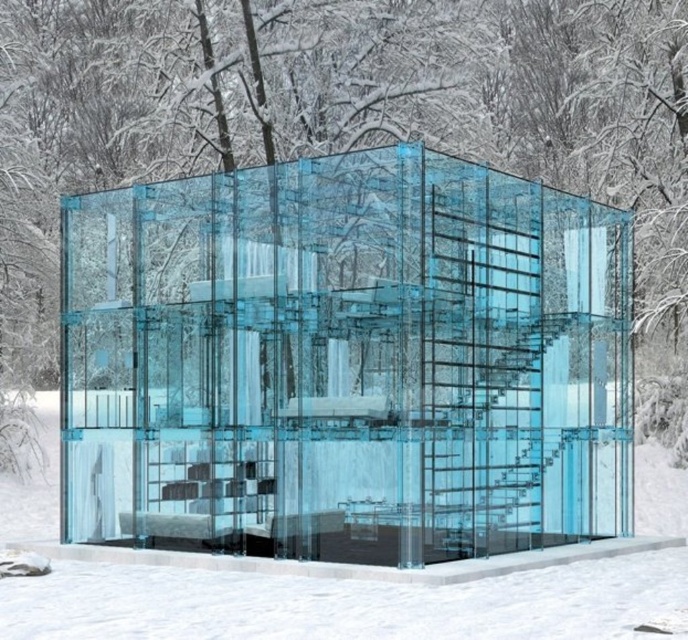
Question: Which object is closer to the camera taking this photo?

Choices:
 (A) transparent glass cube at center
 (B) transparent glass snow at center

Answer: (B)

Question: Does transparent glass cube at center have a lesser width compared to transparent glass snow at center?

Choices:
 (A) no
 (B) yes

Answer: (B)

Question: Can you confirm if transparent glass cube at center is wider than transparent glass snow at center?

Choices:
 (A) yes
 (B) no

Answer: (B)

Question: Is transparent glass cube at center closer to the viewer compared to transparent glass snow at center?

Choices:
 (A) no
 (B) yes

Answer: (A)

Question: Among these objects, which one is farthest from the camera?

Choices:
 (A) transparent glass cube at center
 (B) transparent glass snow at center

Answer: (A)